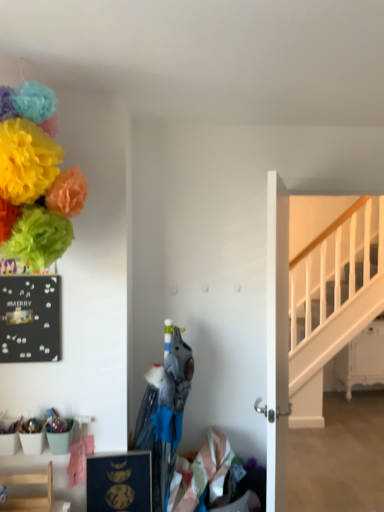
Question: Is matte paper flowers at upper left oriented towards white glossy door at center?

Choices:
 (A) no
 (B) yes

Answer: (A)

Question: From the image's perspective, does matte paper flowers at upper left appear lower than white glossy door at center?

Choices:
 (A) yes
 (B) no

Answer: (B)

Question: From the image's perspective, is matte paper flowers at upper left above white glossy door at center?

Choices:
 (A) yes
 (B) no

Answer: (A)

Question: Is matte paper flowers at upper left facing away from white glossy door at center?

Choices:
 (A) no
 (B) yes

Answer: (A)

Question: From a real-world perspective, is matte paper flowers at upper left located higher than white glossy door at center?

Choices:
 (A) yes
 (B) no

Answer: (A)

Question: Is matte paper flowers at upper left taller than white glossy door at center?

Choices:
 (A) yes
 (B) no

Answer: (B)

Question: From the image's perspective, is light wood chair at lower left below matte paper flowers at upper left?

Choices:
 (A) yes
 (B) no

Answer: (A)

Question: Can you confirm if light wood chair at lower left is thinner than matte paper flowers at upper left?

Choices:
 (A) no
 (B) yes

Answer: (B)

Question: Is light wood chair at lower left next to matte paper flowers at upper left and touching it?

Choices:
 (A) no
 (B) yes

Answer: (A)

Question: Can you confirm if light wood chair at lower left is smaller than matte paper flowers at upper left?

Choices:
 (A) yes
 (B) no

Answer: (A)

Question: Would you say matte paper flowers at upper left is part of light wood chair at lower left's contents?

Choices:
 (A) no
 (B) yes

Answer: (A)

Question: Considering the relative sizes of light wood chair at lower left and matte paper flowers at upper left in the image provided, is light wood chair at lower left bigger than matte paper flowers at upper left?

Choices:
 (A) no
 (B) yes

Answer: (A)

Question: From the image's perspective, is blue matte picture frame at lower center below white glossy door at center?

Choices:
 (A) yes
 (B) no

Answer: (A)